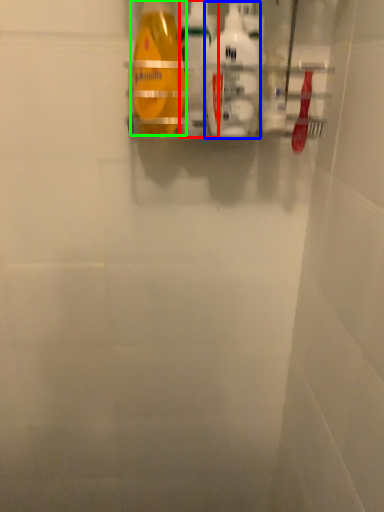
Question: Based on their relative distances, which object is nearer to cleaning product (highlighted by a red box)? Choose from cleaning product (highlighted by a blue box) and bottle (highlighted by a green box).

Choices:
 (A) cleaning product
 (B) bottle

Answer: (B)